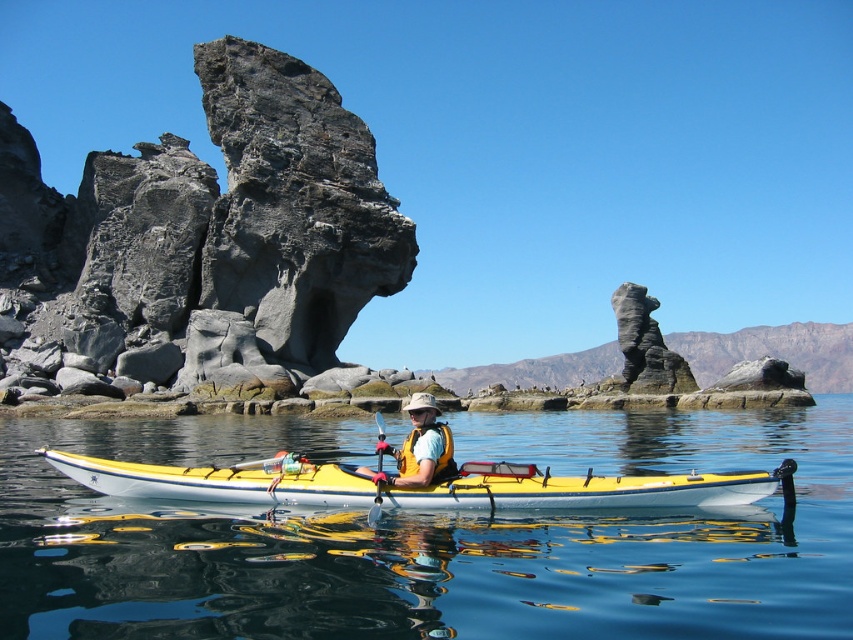
You are a photographer trying to capture the kayaker in the image. Since the transparent blue water at center and the yellow life vest at center are both in focus, which one would you say occupies more visual space in the photo?

The transparent blue water at center is bigger than the yellow life vest at center, so it occupies more visual space in the photo.

You are a photographer planning to capture the reflection of the yellow matte kayak at center in the transparent blue water at center. Based on the scene, can you determine if the kayak will be fully visible in its reflection?

The transparent blue water at center is taller than yellow matte kayak at center, so the kayak will be fully visible in its reflection since the water surface is higher than the kayak.

You are navigating a kayak and see two points marked on your GPS. The first point is labeled as point (457,538) and the second is point (263,470). According to the scene, which point is closer to your current position in the kayak?

Point (457,538) is in front of point (263,470), so it is closer to your current position in the kayak.